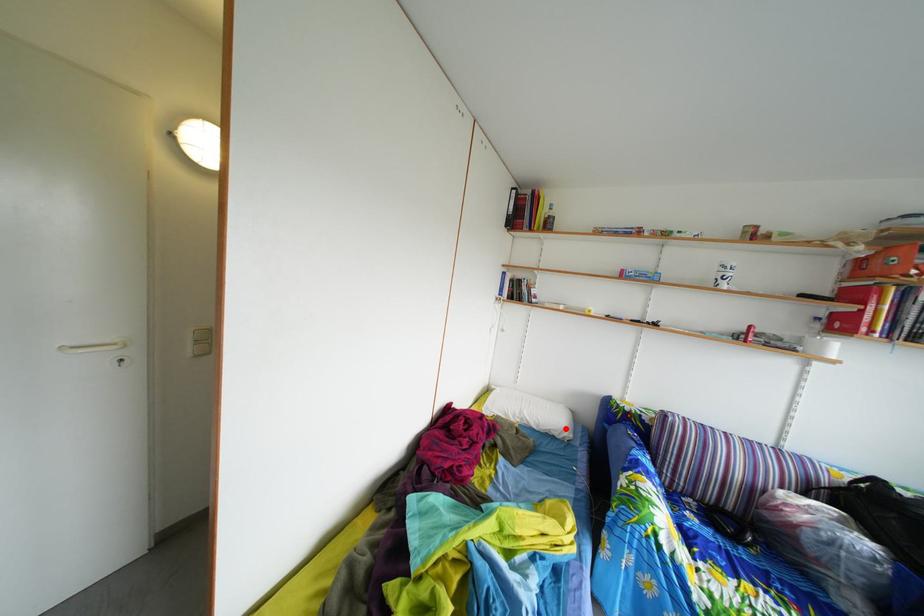
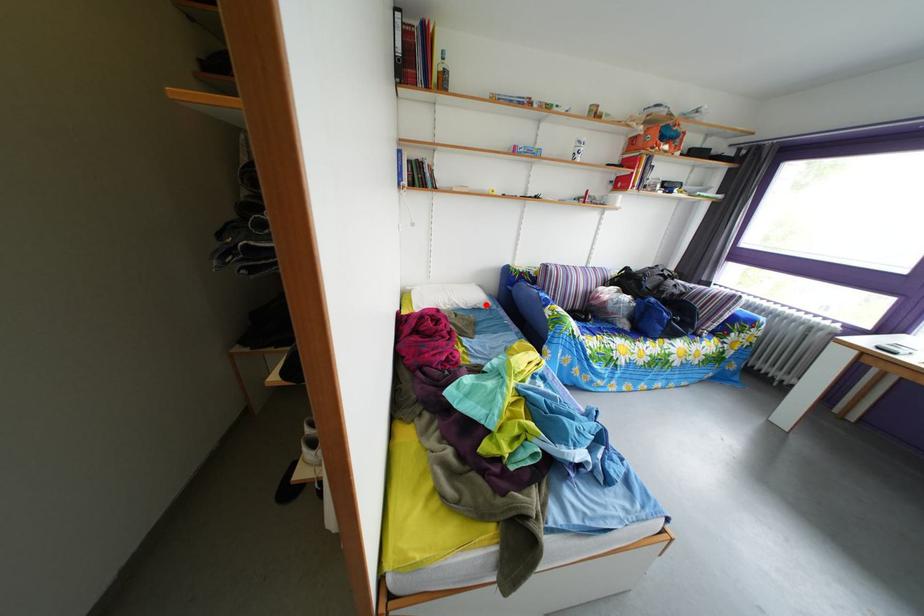
I am providing you with two images of the same scene from different viewpoints. A red point is marked on the first image and another point is marked on the second image. Is the marked point in image1 the same physical position as the marked point in image2?

Yes